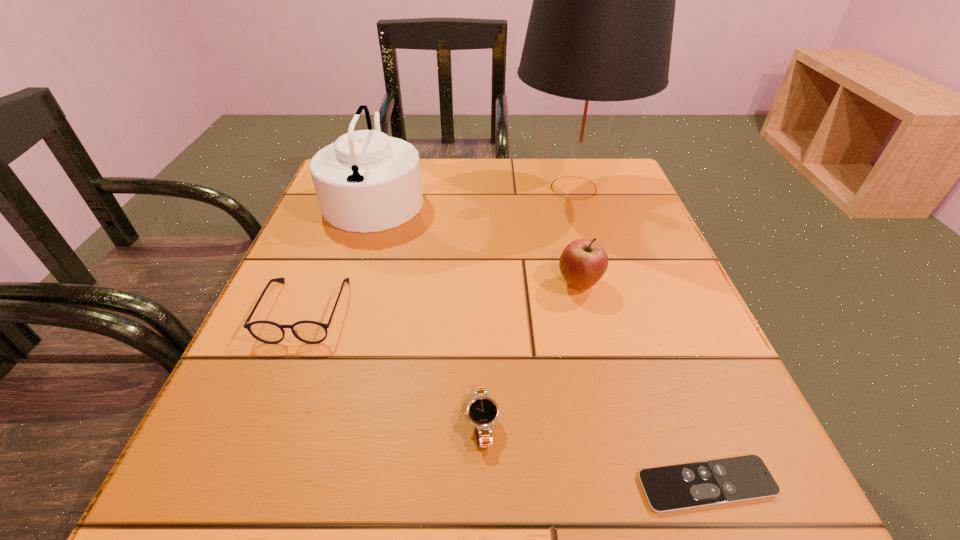
I want to click on lampshade, so click(x=600, y=30).

The image size is (960, 540). I want to click on the second tallest object, so click(x=366, y=181).

I want to click on apple, so click(x=583, y=262).

This screenshot has width=960, height=540. What are the coordinates of `spectacles` in the screenshot? It's located at (311, 332).

This screenshot has width=960, height=540. What are the coordinates of `the second nearest object` in the screenshot? It's located at (482, 411).

This screenshot has width=960, height=540. Identify the location of watch. (482, 411).

The image size is (960, 540). In order to click on the nearest object in this screenshot , I will do `click(683, 486)`.

The image size is (960, 540). In order to click on remote control in this screenshot , I will do click(683, 486).

Locate an element on the screen. The image size is (960, 540). vacant space positioned on the left of the tallest object is located at coordinates (363, 187).

Locate an element on the screen. free spot located on the spout of the second tallest object is located at coordinates (524, 197).